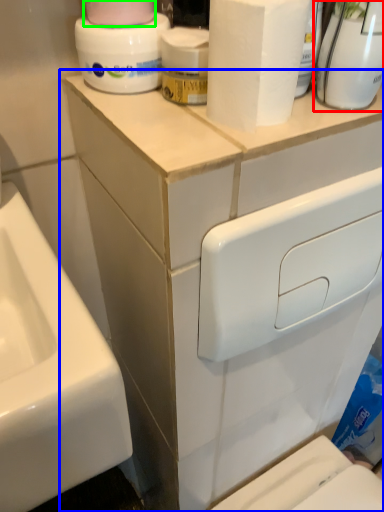
Question: Estimate the real-world distances between objects in this image. Which object is closer to cleaning product (highlighted by a red box), bathroom cabinet (highlighted by a blue box) or toilet paper (highlighted by a green box)?

Choices:
 (A) bathroom cabinet
 (B) toilet paper

Answer: (B)